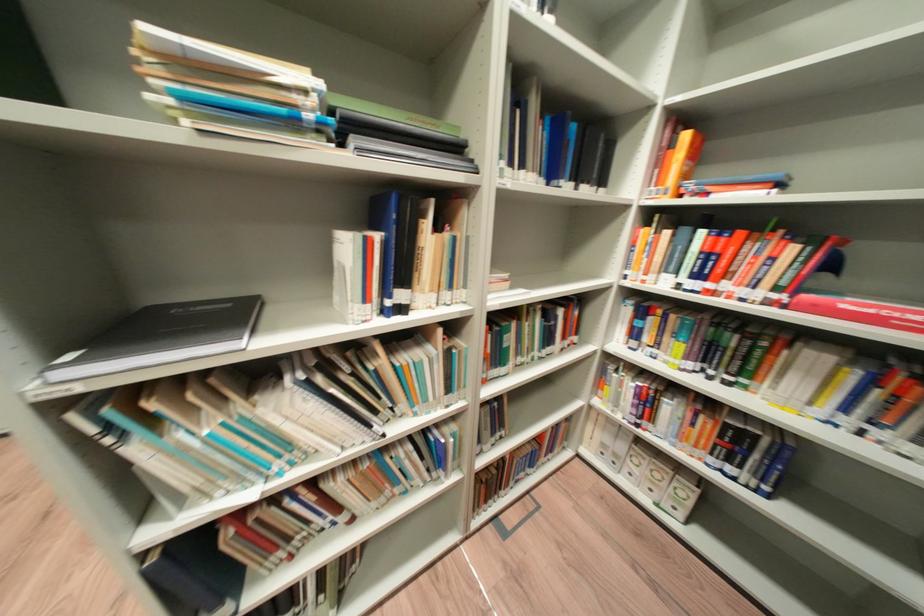
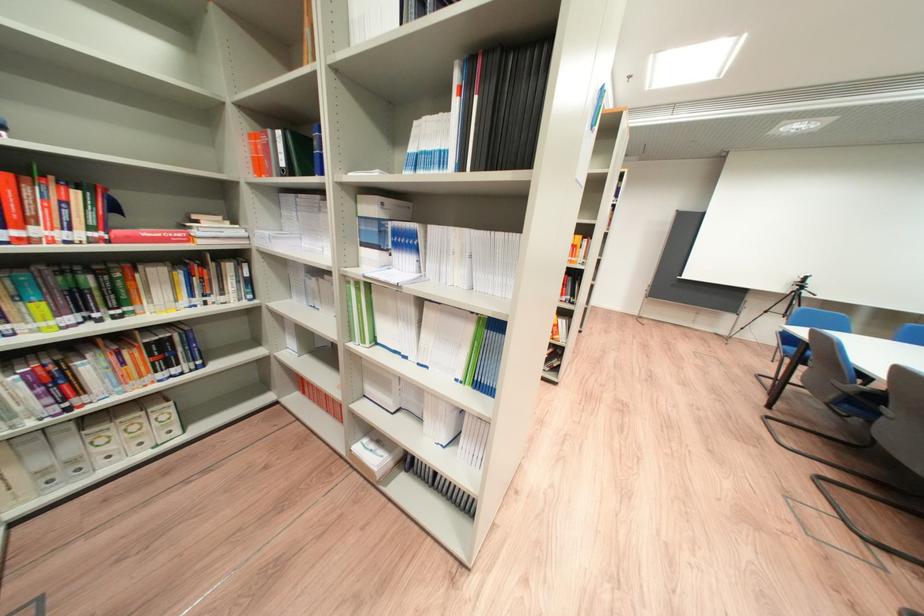
Locate, in the second image, the point that corresponds to [730,257] in the first image.

(9, 201)